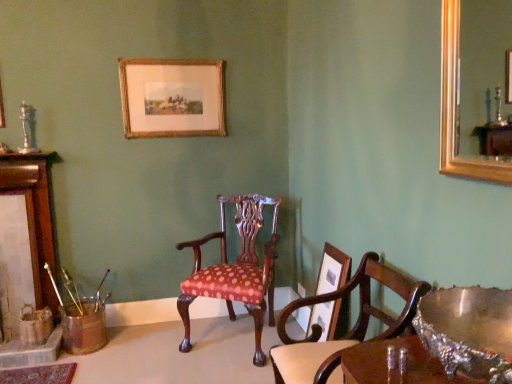
Locate an element on the screen. Image resolution: width=512 pixels, height=384 pixels. vacant area on top of brushed metal fireplace at left (from a real-world perspective) is located at coordinates (17, 158).